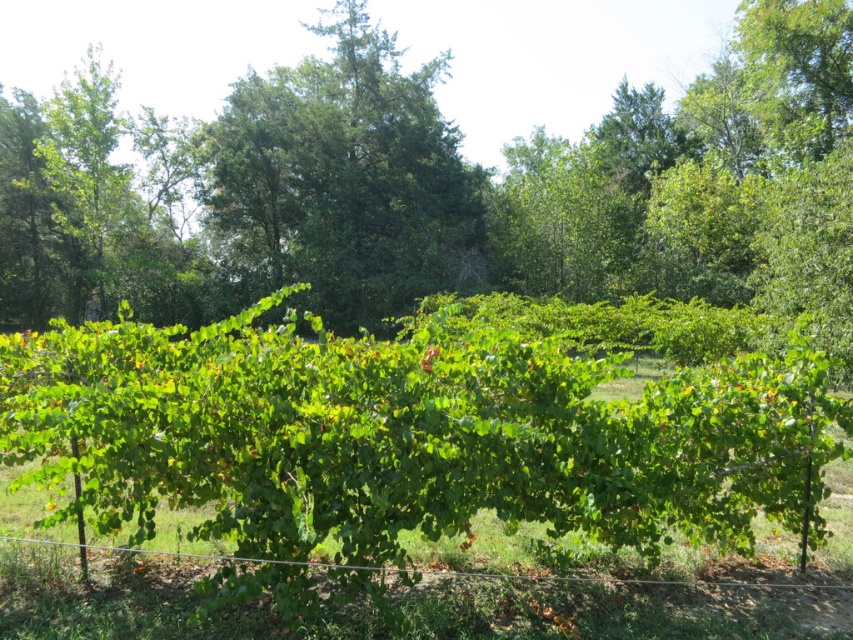
Question: Among these points, which one is nearest to the camera?

Choices:
 (A) (335, 220)
 (B) (836, 61)
 (C) (798, 600)

Answer: (C)

Question: Can you confirm if green leafy bush at center is positioned to the right of green leafy tree at center?

Choices:
 (A) yes
 (B) no

Answer: (A)

Question: Can you confirm if green leafy bush at center is positioned below wire at lower center?

Choices:
 (A) yes
 (B) no

Answer: (B)

Question: Does green leafy bush at center have a lesser width compared to green leafy tree at center?

Choices:
 (A) yes
 (B) no

Answer: (B)

Question: Which point is closer to the camera?

Choices:
 (A) (318, 307)
 (B) (376, 291)

Answer: (B)

Question: Which point is farther to the camera?

Choices:
 (A) green leafy bush at center
 (B) green leafy tree at center
 (C) wire at lower center

Answer: (B)